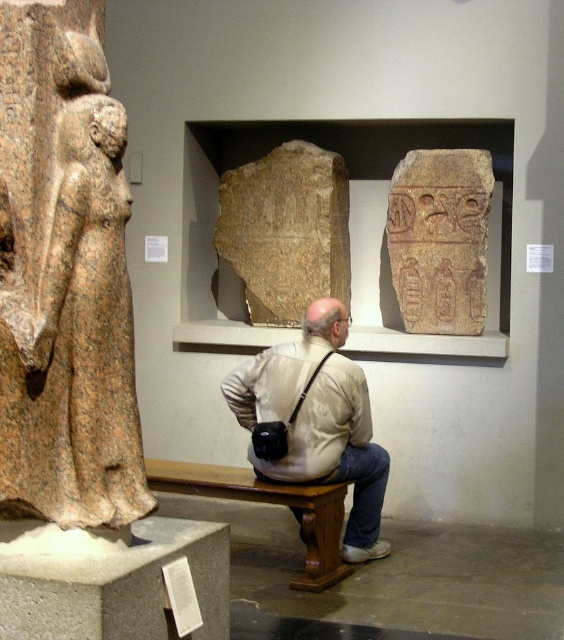
Locate an element on the screen. brown stone hieroglyphics at center is located at coordinates (439, 240).

Which is behind, point (390, 228) or point (315, 522)?

Positioned behind is point (390, 228).

Locate an element on the screen. Image resolution: width=564 pixels, height=640 pixels. brown stone hieroglyphics at center is located at coordinates (439, 240).

Does light beige shirt at center have a lesser height compared to brown stone hieroglyphics at center?

In fact, light beige shirt at center may be taller than brown stone hieroglyphics at center.

Can you confirm if light beige shirt at center is positioned above brown stone hieroglyphics at center?

Actually, light beige shirt at center is below brown stone hieroglyphics at center.

This screenshot has height=640, width=564. Describe the element at coordinates (319, 420) in the screenshot. I see `light beige shirt at center` at that location.

Image resolution: width=564 pixels, height=640 pixels. I want to click on light beige shirt at center, so click(x=319, y=420).

Does brown stone statue at left appear under brown stone hieroglyphics at center?

Indeed, brown stone statue at left is positioned under brown stone hieroglyphics at center.

Can you confirm if brown stone statue at left is positioned to the left of brown stone hieroglyphics at center?

Indeed, brown stone statue at left is positioned on the left side of brown stone hieroglyphics at center.

Does point (11, 435) come farther from viewer compared to point (402, 189)?

No, it is not.

At what (x,y) coordinates should I click in order to perform the action: click on brown stone statue at left. Please return your answer as a coordinate pair (x, y). The image size is (564, 640). Looking at the image, I should click on (68, 300).